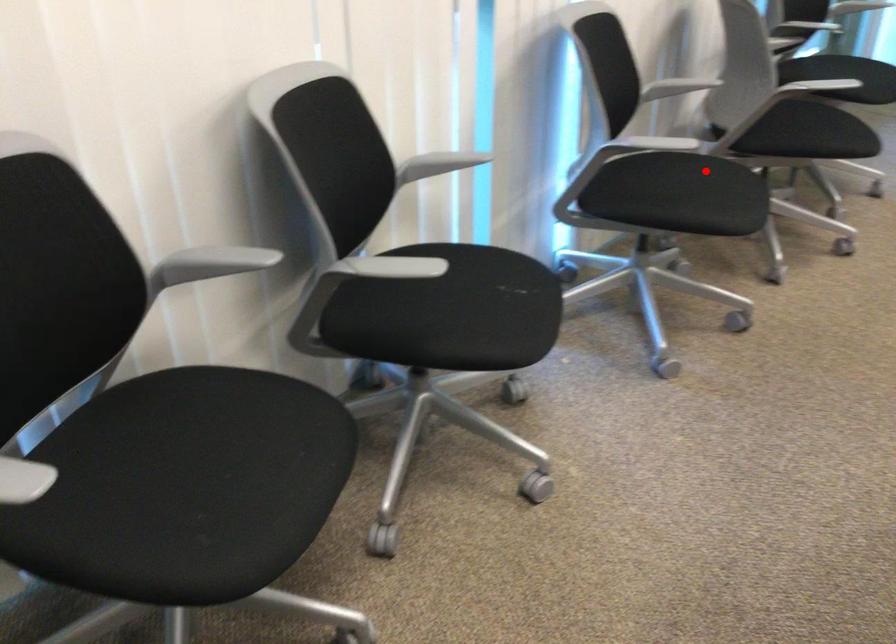
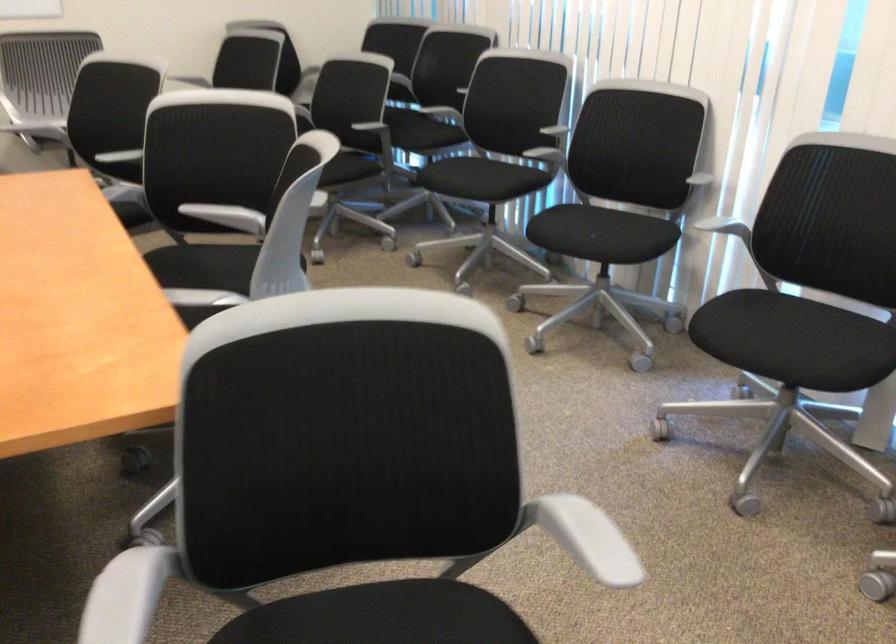
Find the pixel in the second image that matches the highlighted location in the first image.

(795, 342)